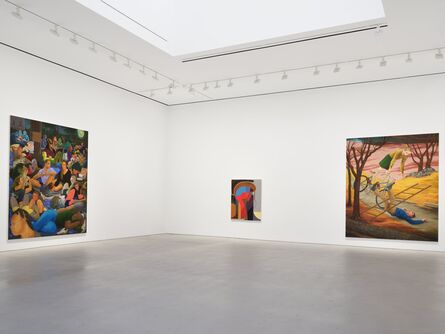
Locate an element on the screen. Image resolution: width=445 pixels, height=334 pixels. floor edge of room is located at coordinates (319, 243), (91, 239).